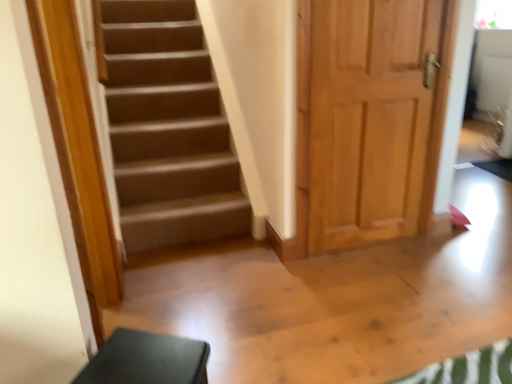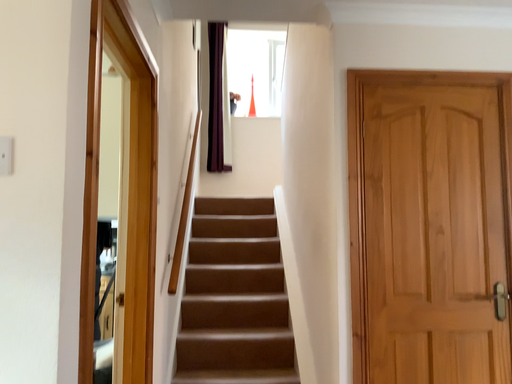
Question: Which way did the camera rotate in the video?

Choices:
 (A) rotated upward
 (B) rotated downward

Answer: (A)